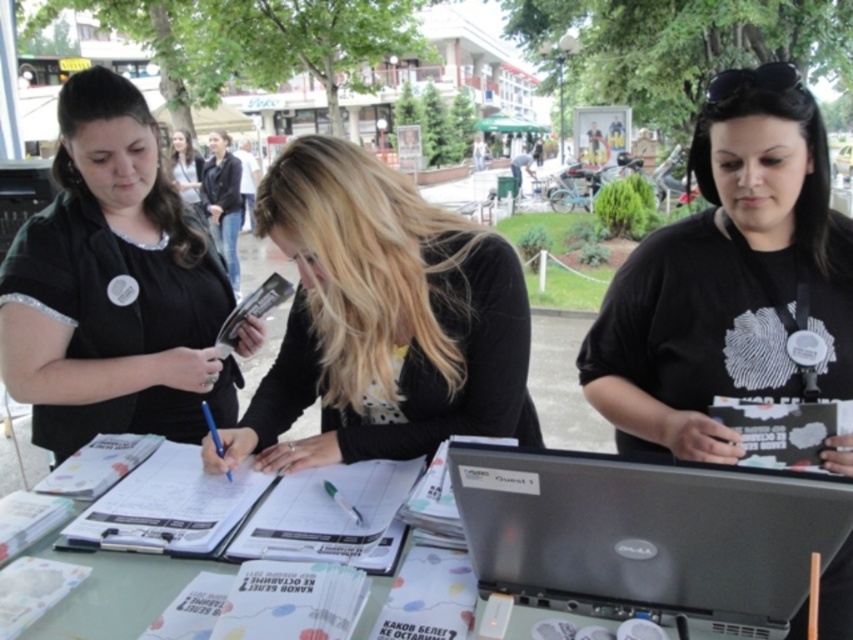
You are standing at the center of the table and want to place a new item exactly where the black matte shirt at center is currently located. Is the space there suitable for placing an item of size 10cm x 10cm?

The black matte shirt at center is located at point (729, 280). Since the question does not provide information about the available space or clutter at that coordinate, it is uncertain if the 10cm x 10cm item can be placed there. Check the area for existing items or clearance.

You are standing at the edge of the table looking towards the Dell laptop. Which object is located at the coordinates point (729, 280)?

The point (729, 280) corresponds to the black matte shirt at center.

Based on the coordinates provided, where is the black matte shirt at center located in the image?

The black matte shirt at center is located at the 2D coordinates point (729, 280).